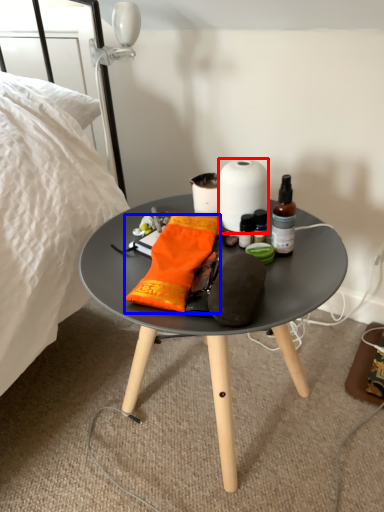
Question: Which object is closer to the camera taking this photo, paper towel (highlighted by a red box) or material (highlighted by a blue box)?

Choices:
 (A) paper towel
 (B) material

Answer: (B)